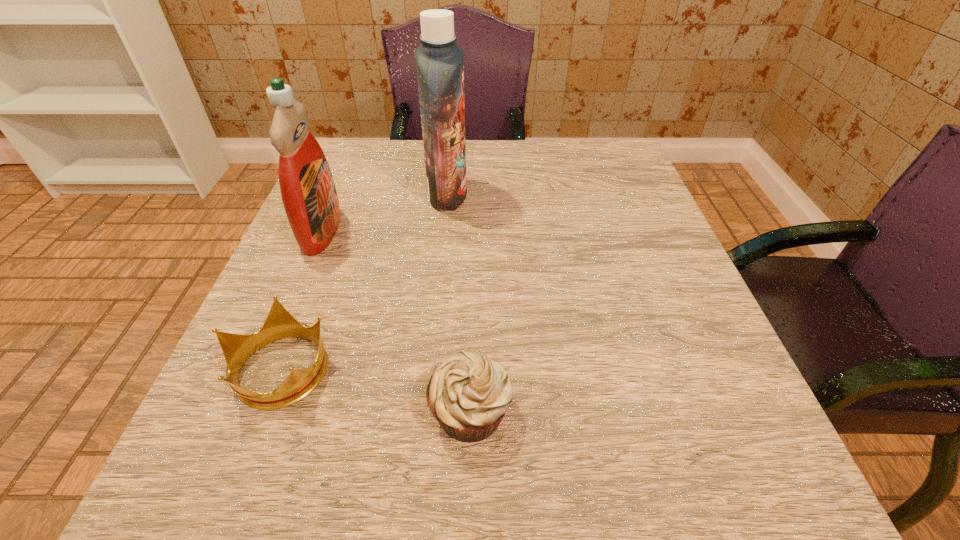
Where is `shampoo`? Image resolution: width=960 pixels, height=540 pixels. shampoo is located at coordinates (439, 61).

This screenshot has height=540, width=960. In order to click on detergent in this screenshot , I will do `click(308, 192)`.

Identify the location of muffin. (469, 394).

Where is `crown`? crown is located at coordinates (280, 324).

Locate an element on the screen. This screenshot has width=960, height=540. vacant space located 0.350m on the front label of the shampoo is located at coordinates (626, 194).

Where is `vacant space located 0.130m on the front surface of the second tallest object`? The width and height of the screenshot is (960, 540). vacant space located 0.130m on the front surface of the second tallest object is located at coordinates (406, 231).

Where is `free space located 0.260m on the right of the muffin`? The width and height of the screenshot is (960, 540). free space located 0.260m on the right of the muffin is located at coordinates (704, 411).

Where is `vacant position located on the right of the crown`? Image resolution: width=960 pixels, height=540 pixels. vacant position located on the right of the crown is located at coordinates (493, 368).

You are a GUI agent. You are given a task and a screenshot of the screen. Output one action in this format:
    pyautogui.click(x=<x>, y=<y>)
    Task: Click on the object positioned at the far edge
    This screenshot has width=960, height=540.
    Given the screenshot: What is the action you would take?
    pyautogui.click(x=439, y=61)

You are a GUI agent. You are given a task and a screenshot of the screen. Output one action in this format:
    pyautogui.click(x=<x>, y=<y>)
    Task: Click on the object positioned at the near edge
    This screenshot has width=960, height=540.
    Given the screenshot: What is the action you would take?
    pyautogui.click(x=469, y=394)